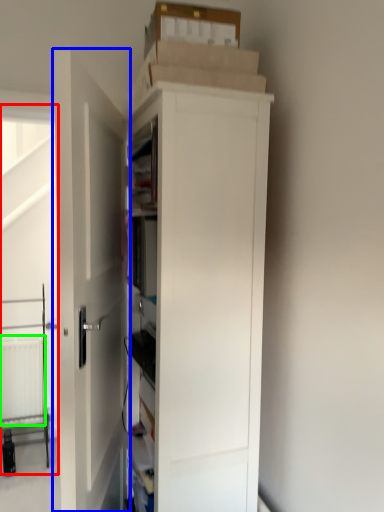
Question: Which object is positioned farthest from screen door (highlighted by a red box)? Select from door (highlighted by a blue box) and radiator (highlighted by a green box).

Choices:
 (A) door
 (B) radiator

Answer: (A)